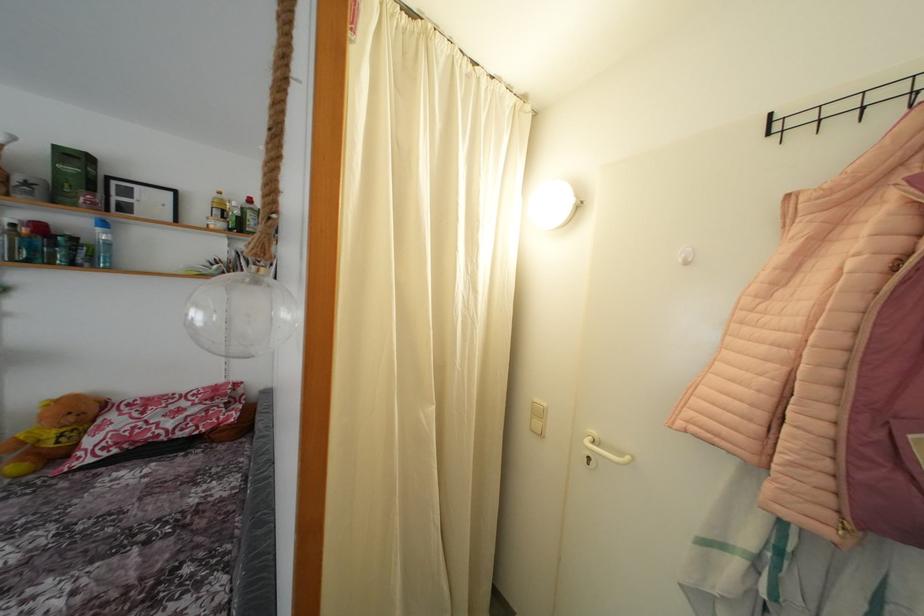
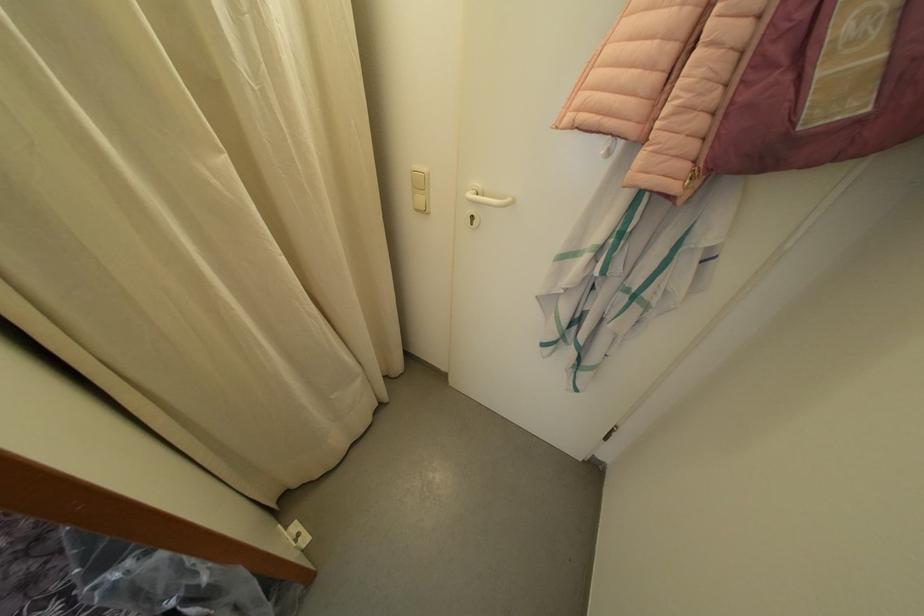
The point at (599, 438) is marked in the first image. Where is the corresponding point in the second image?

(482, 190)